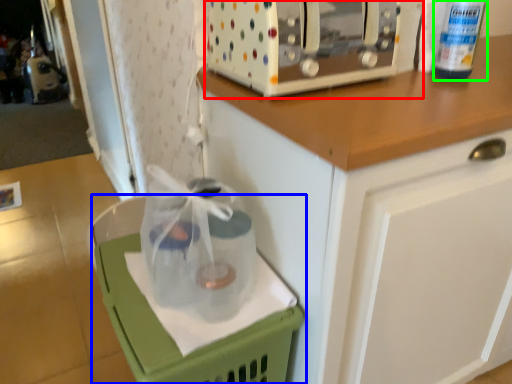
Question: Which object is the closest to the home appliance (highlighted by a red box)? Choose among these: basket (highlighted by a blue box) or bottle (highlighted by a green box).

Choices:
 (A) basket
 (B) bottle

Answer: (B)